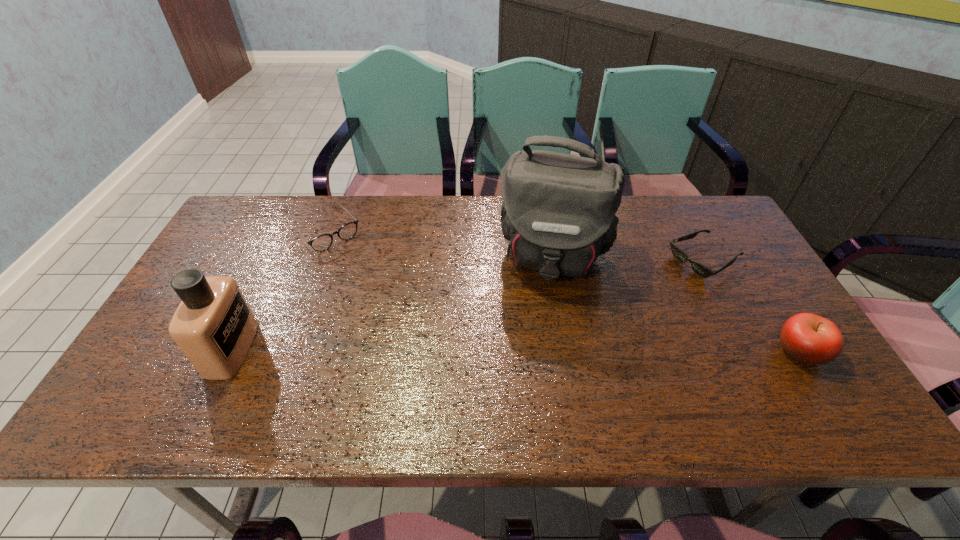
Find the location of `the fourth shortest object`. the fourth shortest object is located at coordinates (214, 327).

In order to click on apple in this screenshot , I will do `click(808, 338)`.

Where is `spectacles`? Image resolution: width=960 pixels, height=540 pixels. spectacles is located at coordinates pos(321,243).

Where is `the third object from right to left`? Image resolution: width=960 pixels, height=540 pixels. the third object from right to left is located at coordinates [x=558, y=214].

Where is `shoulder bag`? shoulder bag is located at coordinates (558, 214).

Where is `sunglasses`? Image resolution: width=960 pixels, height=540 pixels. sunglasses is located at coordinates (700, 269).

At what (x,y) coordinates should I click in order to perform the action: click on free region located 0.070m on the front label of the second tallest object. Please return your answer as a coordinate pair (x, y). The width and height of the screenshot is (960, 540). Looking at the image, I should click on (279, 349).

What are the coordinates of `vacant space located 0.260m on the back of the apple` in the screenshot? It's located at (744, 261).

Identify the location of vacant space situated through the lenses of the second shortest object. (401, 315).

At what (x,y) coordinates should I click in order to perform the action: click on free space located 0.150m through the lenses of the second shortest object. Please return your answer as a coordinate pair (x, y). Image resolution: width=960 pixels, height=540 pixels. Looking at the image, I should click on (367, 277).